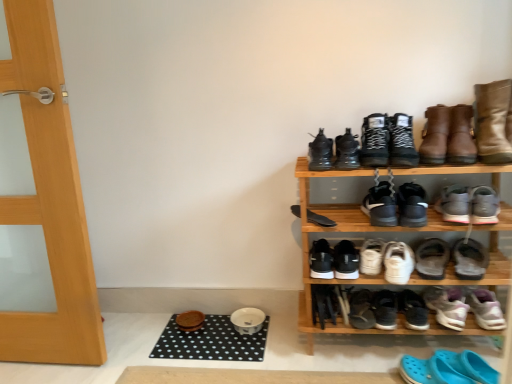
At what (x,y) coordinates should I click in order to perform the action: click on free space between wooden door at left and black dotted mat at lower center, the 2th doormat from the front. Please return your answer as a coordinate pair (x, y). The height and width of the screenshot is (384, 512). Looking at the image, I should click on (144, 343).